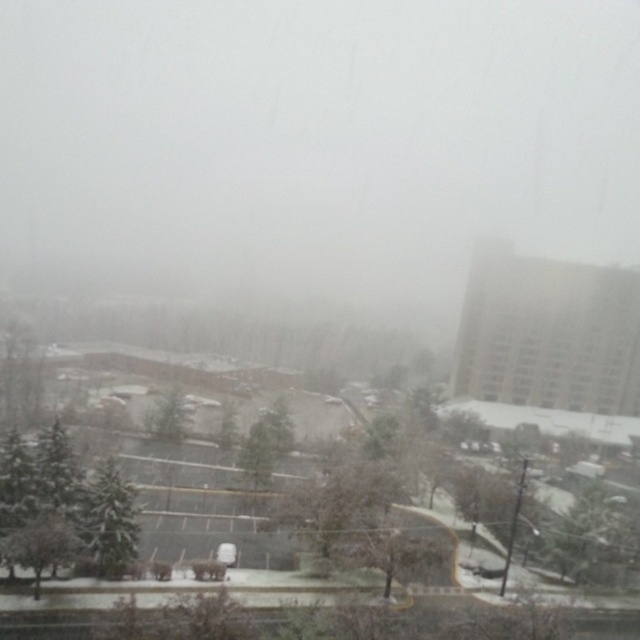
Question: Which object is the closest to the green matte tree at center-left?

Choices:
 (A) green matte tree at center
 (B) snow-covered tree at lower left

Answer: (B)

Question: Which point is closer to the camera taking this photo?

Choices:
 (A) [122, 557]
 (B) [68, 552]
 (C) [156, 422]

Answer: (B)

Question: Which point is farther to the camera?

Choices:
 (A) (36, 518)
 (B) (115, 504)

Answer: (B)

Question: Is snow-covered tree at lower left to the left of green matte tree at center from the viewer's perspective?

Choices:
 (A) yes
 (B) no

Answer: (B)

Question: Is green matte tree at center-left below green matte tree at center?

Choices:
 (A) no
 (B) yes

Answer: (B)

Question: Where is snow-covered tree at lower left located in relation to green matte tree at center in the image?

Choices:
 (A) below
 (B) above

Answer: (A)